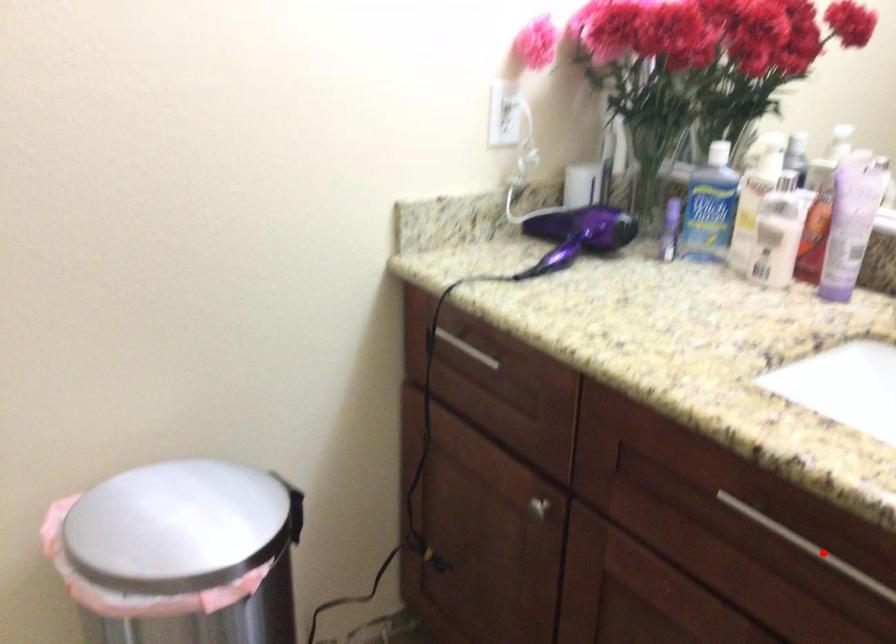
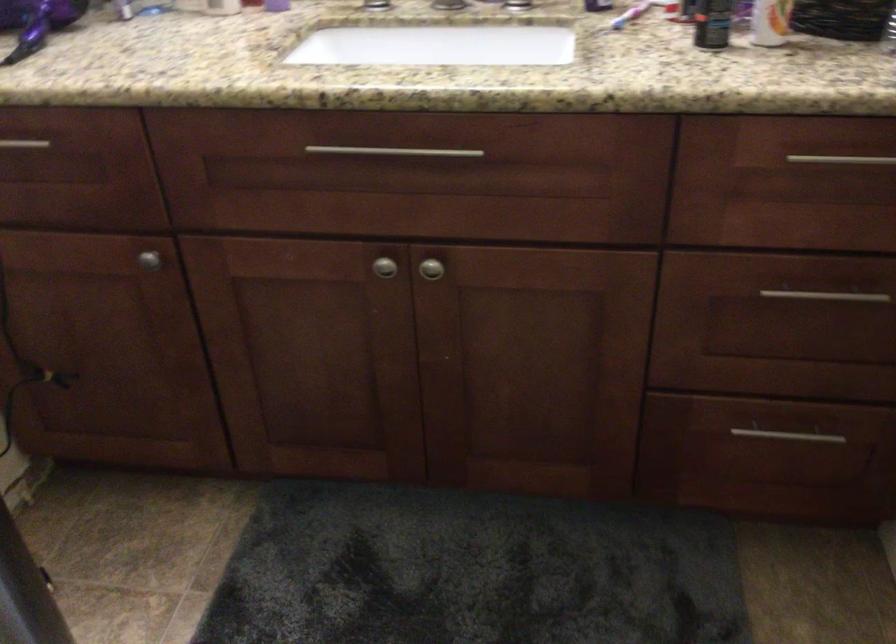
Question: I am providing you with two images of the same scene from different viewpoints. In image1, a red point is highlighted. Considering the same 3D point in image2, which of the following is correct?

Choices:
 (A) It is closer
 (B) It is farther

Answer: (B)